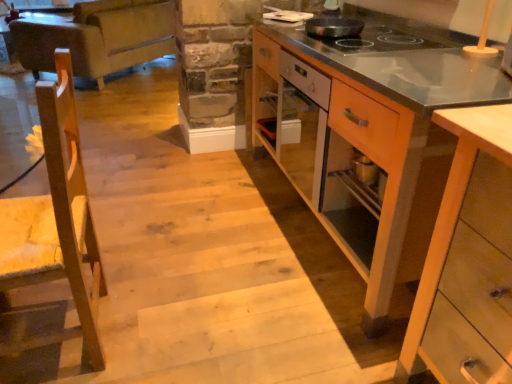
Locate an element on the screen. The width and height of the screenshot is (512, 384). vacant space to the right of wooden chair at left is located at coordinates (165, 321).